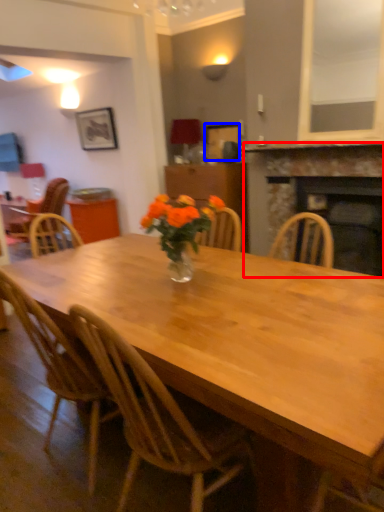
Question: Which of the following is the farthest to the observer, fireplace (highlighted by a red box) or picture frame (highlighted by a blue box)?

Choices:
 (A) fireplace
 (B) picture frame

Answer: (B)